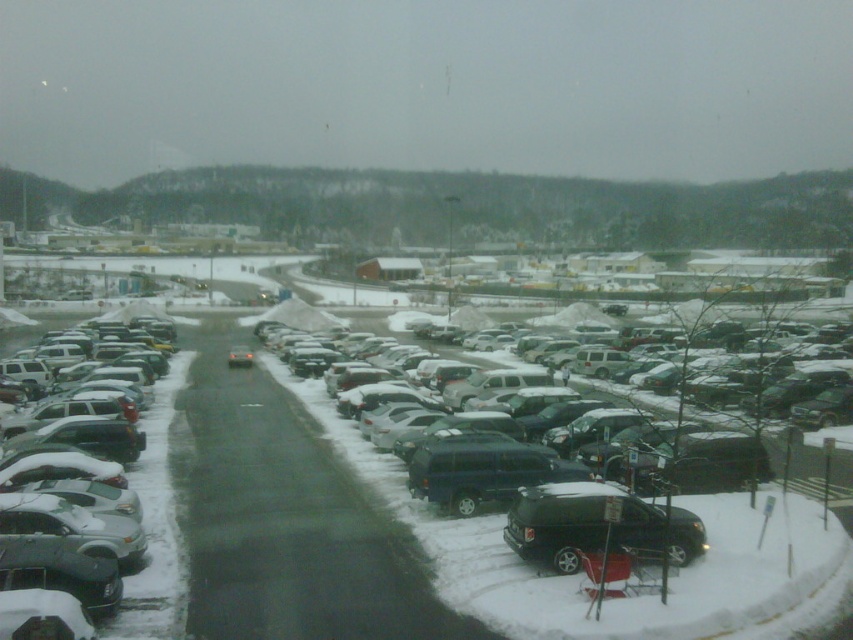
You are standing at the point marked by the coordinate point (267,520) in the snowy parking lot. Looking around, you see snow covered cars at center. Which direction should you walk to reach the snow covered cars at center?

You are already at the location of the snow covered cars at center, as the point (267,520) represents their position.